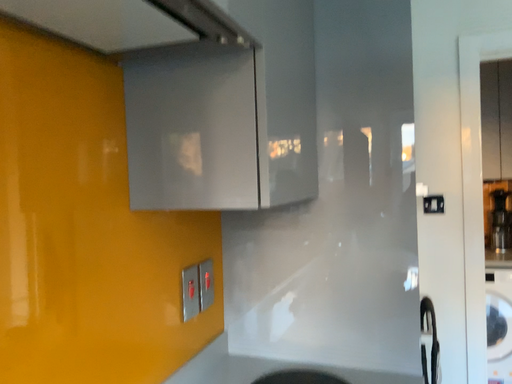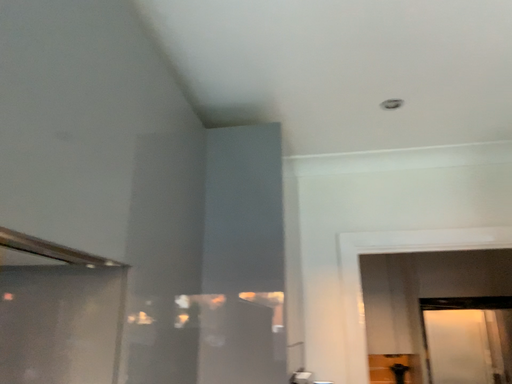
Question: How did the camera likely rotate when shooting the video?

Choices:
 (A) rotated right
 (B) rotated left

Answer: (A)